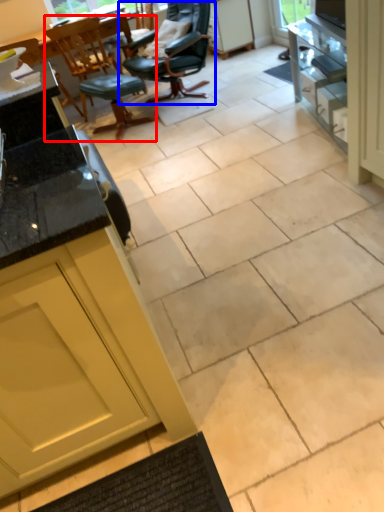
Question: Which point is further to the camera, chair (highlighted by a red box) or chair (highlighted by a blue box)?

Choices:
 (A) chair
 (B) chair

Answer: (A)